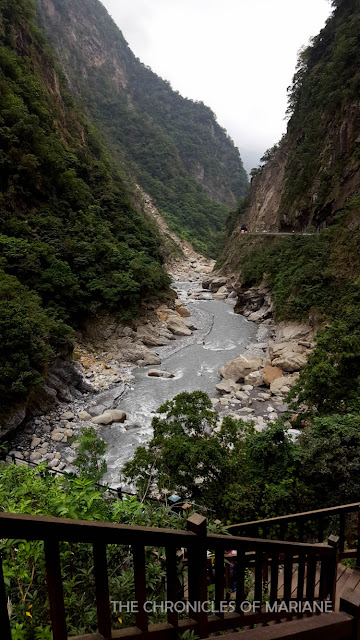
Locate an element on the screen. the 4th wooden slat on railing in the foreground is located at coordinates (142, 580).